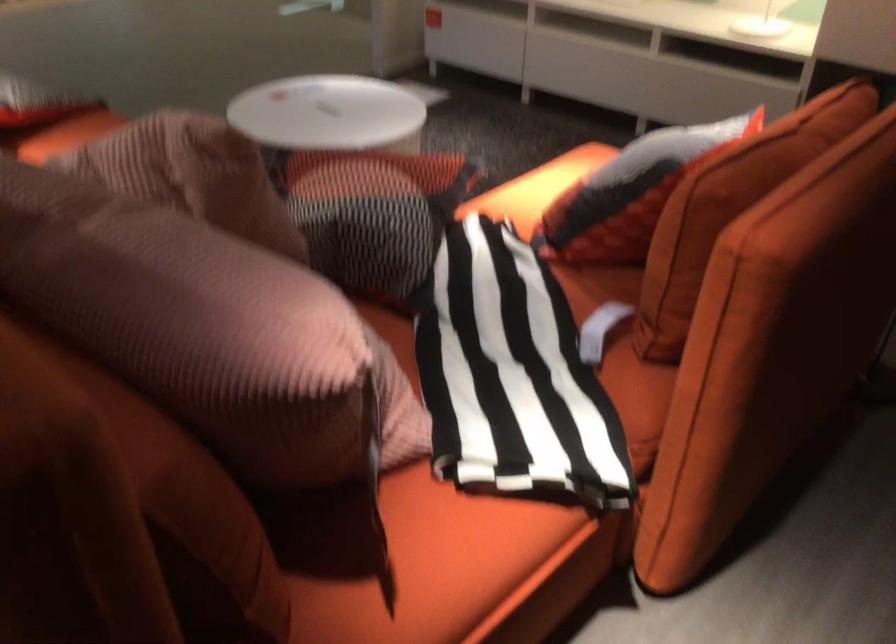
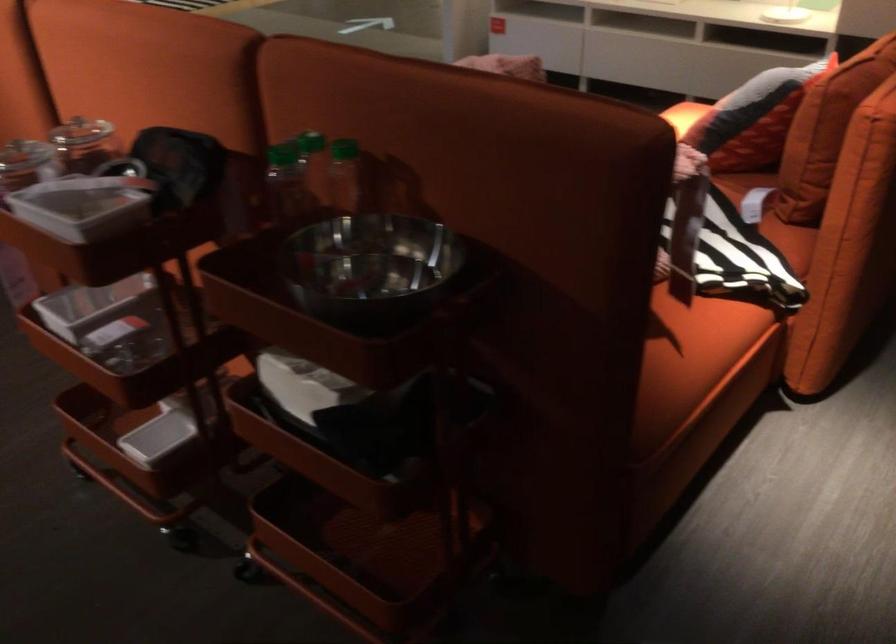
The point at (512, 375) is marked in the first image. Where is the corresponding point in the second image?

(703, 231)